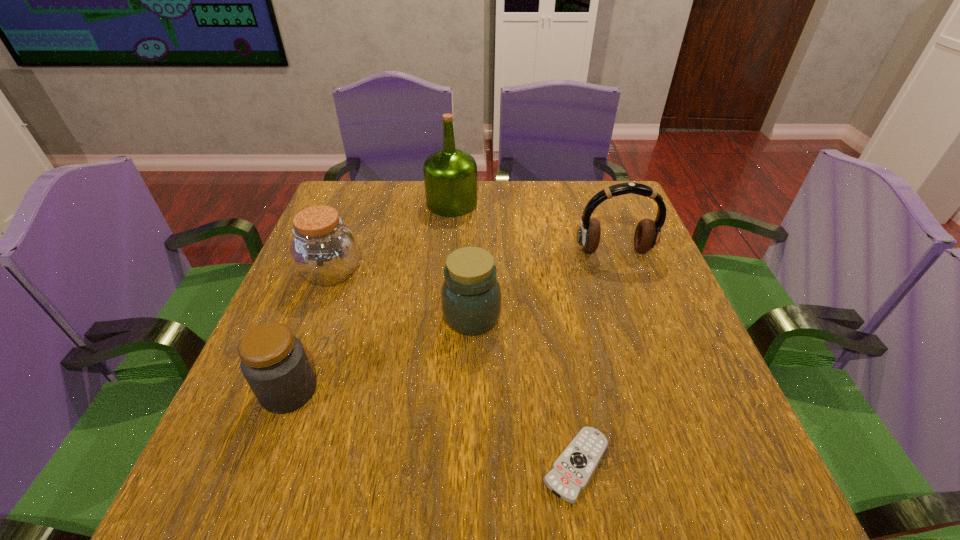
The height and width of the screenshot is (540, 960). I want to click on olive oil, so click(450, 175).

Locate an element on the screen. the farthest object is located at coordinates (450, 175).

Image resolution: width=960 pixels, height=540 pixels. In order to click on the rightmost object in this screenshot , I will do `click(647, 234)`.

You are a GUI agent. You are given a task and a screenshot of the screen. Output one action in this format:
    pyautogui.click(x=<x>, y=<y>)
    Task: Click on the headset
    
    Given the screenshot: What is the action you would take?
    pyautogui.click(x=647, y=234)

At what (x,y) coordinates should I click in order to perform the action: click on the farthest jar. Please return your answer as a coordinate pair (x, y). This screenshot has width=960, height=540. Looking at the image, I should click on (324, 250).

You are a GUI agent. You are given a task and a screenshot of the screen. Output one action in this format:
    pyautogui.click(x=<x>, y=<y>)
    Task: Click on the rightmost jar
    This screenshot has height=540, width=960.
    Given the screenshot: What is the action you would take?
    pyautogui.click(x=471, y=295)

Where is `the second nearest jar`? This screenshot has width=960, height=540. the second nearest jar is located at coordinates (471, 295).

In order to click on the fifth farthest object in this screenshot , I will do tap(273, 361).

What are the coordinates of `the shortest object` in the screenshot? It's located at (571, 472).

Where is `the nearest object`? The image size is (960, 540). the nearest object is located at coordinates (571, 472).